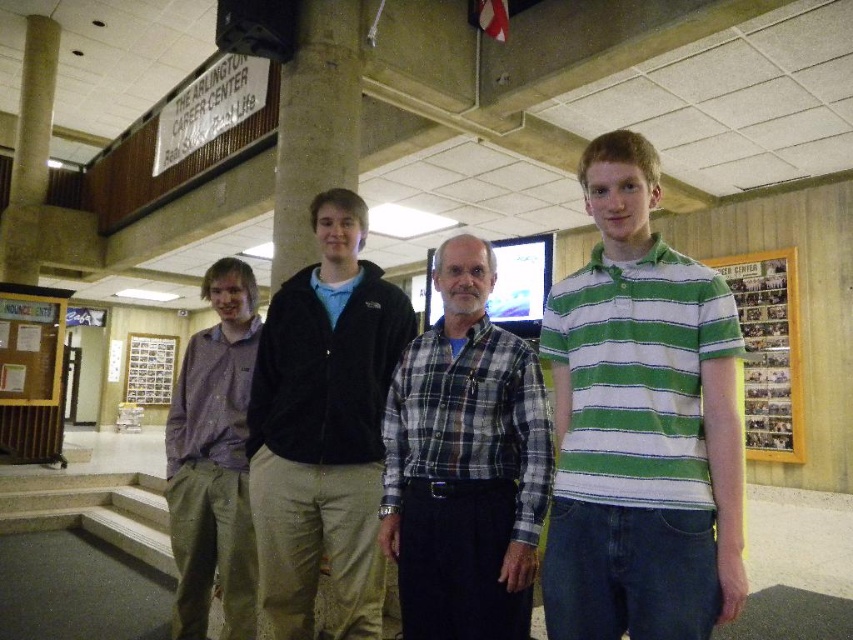
You are a photographer setting up for a group photo. You notice the green striped polo shirt at center and the wooden frame at right. Which object should you adjust to ensure both are fully visible in the shot?

The green striped polo shirt at center is shorter than the wooden frame at right. To ensure both are fully visible, you should adjust the angle or position so the shorter green striped polo shirt at center is not blocked by the taller wooden frame at right.

You are standing in front of the group of four individuals. There are two points marked in the image at coordinates point (688, 564) and point (764, 289). Which of these points is nearer to your current position?

Point (688, 564) is closer to the viewer than point (764, 289), so the point at (688, 564) is nearer to your current position.

You are a tailor measuring for alterations. You need to determine which item, the velvet black jacket at center or the wooden frame at right, requires a longer vertical adjustment. Based on their heights, which one should you prioritize?

The wooden frame at right is taller than the velvet black jacket at center, so you should prioritize the wooden frame at right for vertical adjustments since it requires more space.